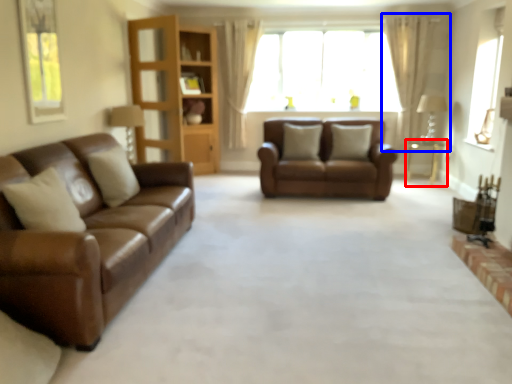
Question: Which of the following is the farthest to the observer, table (highlighted by a red box) or curtain (highlighted by a blue box)?

Choices:
 (A) table
 (B) curtain

Answer: (B)